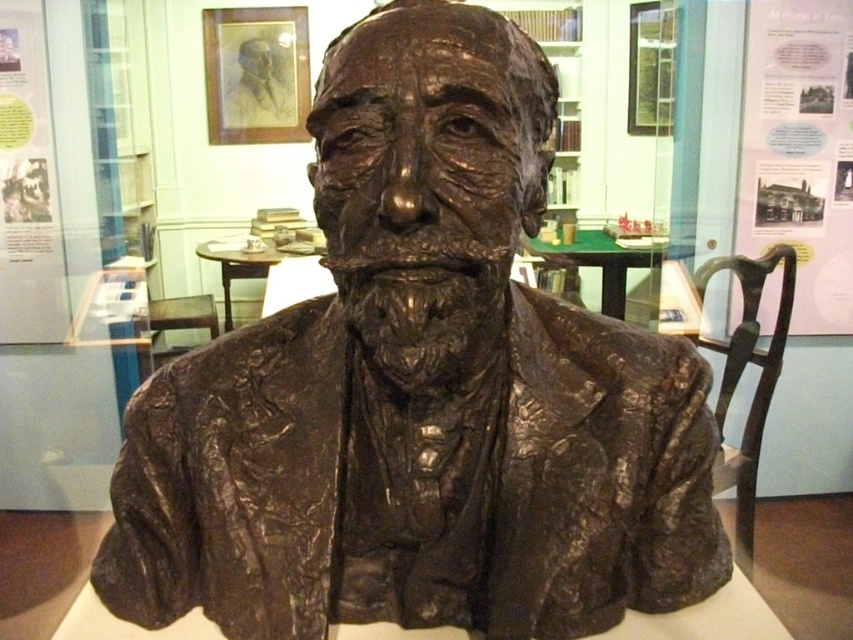
Identify the location of bronze polished chair at right. (740, 376).

Is point (740, 336) closer to camera compared to point (263, 58)?

Yes, point (740, 336) is closer to viewer.

The height and width of the screenshot is (640, 853). Describe the element at coordinates (740, 376) in the screenshot. I see `bronze polished chair at right` at that location.

In order to click on bronze polished chair at right in this screenshot , I will do `click(740, 376)`.